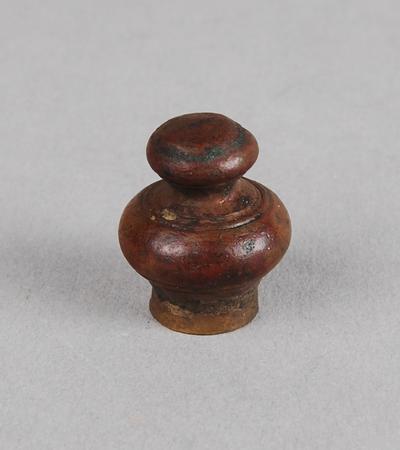
Where is `table`? The width and height of the screenshot is (400, 450). table is located at coordinates (333, 352).